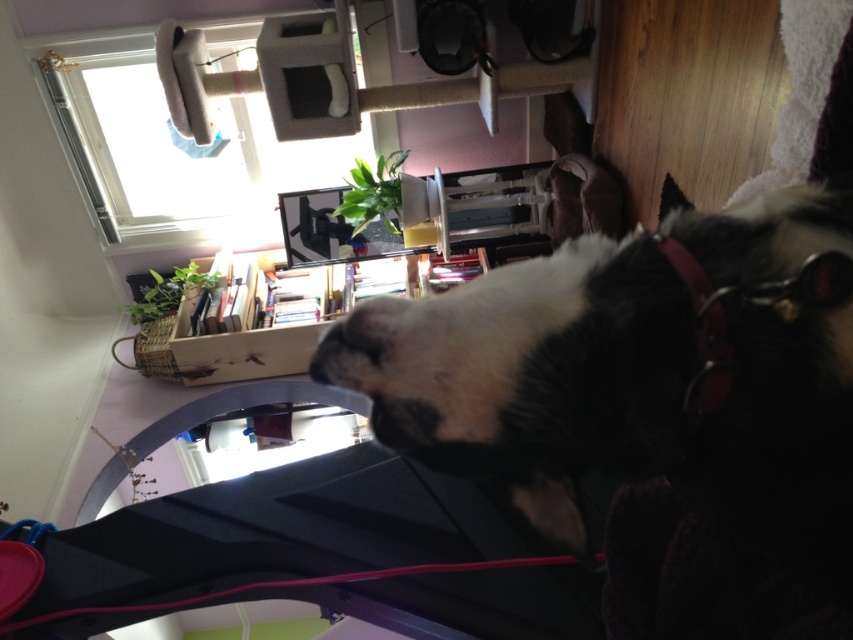
Is black fuzzy dog at center smaller than white fur nose at center?

No.

Which of these two, black fuzzy dog at center or white fur nose at center, stands shorter?

With less height is white fur nose at center.

I want to click on black fuzzy dog at center, so click(x=646, y=376).

This screenshot has height=640, width=853. Identify the location of black fuzzy dog at center. (646, 376).

Can you confirm if leather-like red collar at center right is positioned above white fur nose at center?

No, leather-like red collar at center right is not above white fur nose at center.

Is leather-like red collar at center right closer to the viewer compared to white fur nose at center?

Yes, leather-like red collar at center right is closer to the viewer.

I want to click on leather-like red collar at center right, so click(x=701, y=336).

Can you confirm if black fuzzy dog at center is bigger than leather-like red collar at center right?

Indeed, black fuzzy dog at center has a larger size compared to leather-like red collar at center right.

Locate an element on the screen. Image resolution: width=853 pixels, height=640 pixels. black fuzzy dog at center is located at coordinates (646, 376).